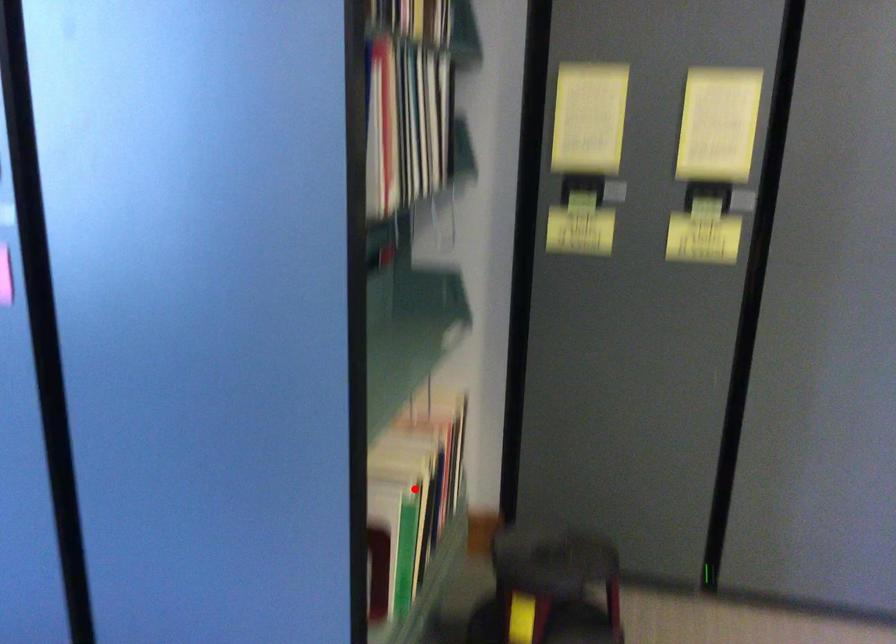
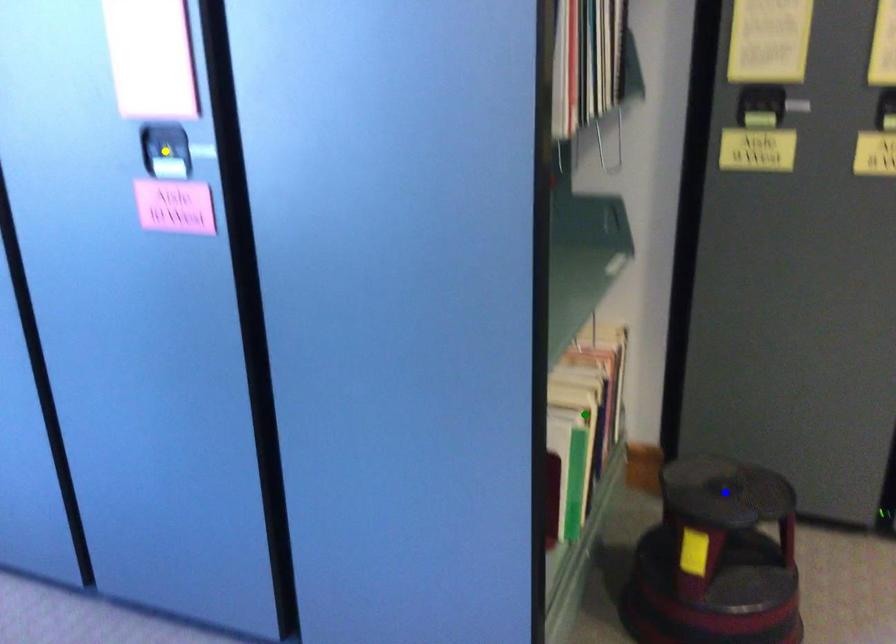
Question: I am providing you with two images of the same scene from different viewpoints. A red point is marked on the first image. You are given multiple points on the second image. Which point in image 2 represents the same 3d spot as the red point in image 1?

Choices:
 (A) yellow point
 (B) blue point
 (C) green point

Answer: (C)